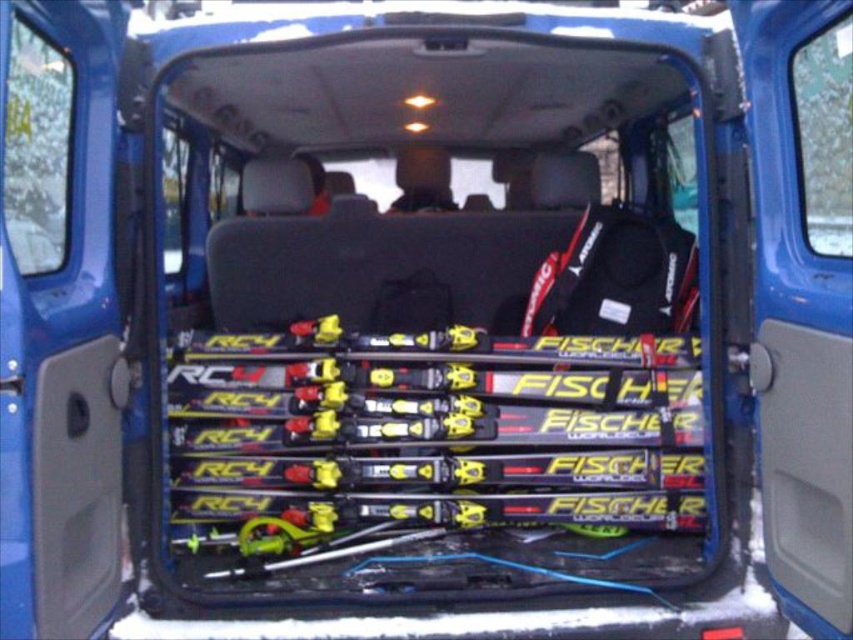
Question: Which point is farther to the camera?

Choices:
 (A) matte black ski bag at center
 (B) yellow matte fischer rc4 ski at center

Answer: (A)

Question: Does yellow matte fischer rc4 ski at center appear on the left side of matte black ski bag at center?

Choices:
 (A) yes
 (B) no

Answer: (A)

Question: Does yellow matte fischer rc4 ski at center appear under matte black ski bag at center?

Choices:
 (A) yes
 (B) no

Answer: (A)

Question: Is yellow matte fischer rc4 ski at center closer to the viewer compared to matte black ski bag at center?

Choices:
 (A) no
 (B) yes

Answer: (B)